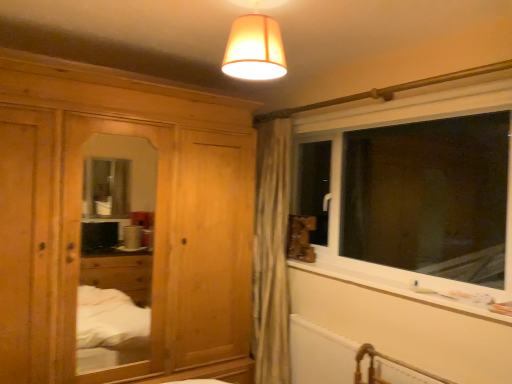
The width and height of the screenshot is (512, 384). What do you see at coordinates (413, 189) in the screenshot? I see `white plastic window at right` at bounding box center [413, 189].

This screenshot has height=384, width=512. What are the coordinates of `white plastic window at right` in the screenshot? It's located at (413, 189).

This screenshot has height=384, width=512. Describe the element at coordinates (321, 354) in the screenshot. I see `white matte radiator at lower right` at that location.

Describe the element at coordinates (403, 284) in the screenshot. I see `white plastic window sill at lower right` at that location.

The width and height of the screenshot is (512, 384). Find the location of `natural wood wardrobe at left`. natural wood wardrobe at left is located at coordinates pyautogui.click(x=155, y=219).

Considering the sizes of matte orange fabric lampshade at upper center and white matte radiator at lower right in the image, is matte orange fabric lampshade at upper center bigger or smaller than white matte radiator at lower right?

In the image, matte orange fabric lampshade at upper center appears to be smaller than white matte radiator at lower right.

From their relative heights in the image, would you say matte orange fabric lampshade at upper center is taller or shorter than white matte radiator at lower right?

Considering their sizes, matte orange fabric lampshade at upper center has less height than white matte radiator at lower right.

Consider the image. Does matte orange fabric lampshade at upper center touch white matte radiator at lower right?

They are not placed beside each other.

From the image's perspective, who appears lower, matte orange fabric lampshade at upper center or white matte radiator at lower right?

white matte radiator at lower right is shown below in the image.

Is natural wood wardrobe at left smaller than matte orange fabric lampshade at upper center?

No, natural wood wardrobe at left is not smaller than matte orange fabric lampshade at upper center.

Looking at this image, would you say natural wood wardrobe at left is to the left or to the right of matte orange fabric lampshade at upper center in the picture?

natural wood wardrobe at left is positioned on matte orange fabric lampshade at upper center's left side.

Is natural wood wardrobe at left outside of matte orange fabric lampshade at upper center?

Absolutely, natural wood wardrobe at left is external to matte orange fabric lampshade at upper center.

Find the location of a particular element. The width and height of the screenshot is (512, 384). lamp in front of the white plastic window at right is located at coordinates (255, 44).

Can you confirm if matte orange fabric lampshade at upper center is positioned to the right of white plastic window at right?

In fact, matte orange fabric lampshade at upper center is to the left of white plastic window at right.

In the scene shown: From the image's perspective, is matte orange fabric lampshade at upper center beneath white plastic window at right?

Actually, matte orange fabric lampshade at upper center appears above white plastic window at right in the image.

Measure the distance between matte orange fabric lampshade at upper center and white plastic window at right.

matte orange fabric lampshade at upper center and white plastic window at right are 5.79 feet apart from each other.

Considering the relative sizes of matte orange fabric lampshade at upper center and white plastic window sill at lower right in the image provided, is matte orange fabric lampshade at upper center wider than white plastic window sill at lower right?

Yes, matte orange fabric lampshade at upper center is wider than white plastic window sill at lower right.

Who is shorter, matte orange fabric lampshade at upper center or white plastic window sill at lower right?

With less height is white plastic window sill at lower right.

How much distance is there between matte orange fabric lampshade at upper center and white plastic window sill at lower right?

They are 4.71 feet apart.

From the image's perspective, who appears lower, matte orange fabric lampshade at upper center or white plastic window sill at lower right?

white plastic window sill at lower right is shown below in the image.

Between white matte radiator at lower right and white plastic window at right, which one is positioned in front?

white matte radiator at lower right is in front.

This screenshot has height=384, width=512. What are the coordinates of `radiator that is on the left side of white plastic window at right` in the screenshot? It's located at (321, 354).

Can you tell me how much white matte radiator at lower right and white plastic window at right differ in facing direction?

They differ by 0.684 degrees in their facing directions.

Which of these two, natural wood wardrobe at left or white plastic window sill at lower right, is thinner?

With smaller width is white plastic window sill at lower right.

From the image's perspective, which object appears higher, natural wood wardrobe at left or white plastic window sill at lower right?

From the image's view, natural wood wardrobe at left is above.

The width and height of the screenshot is (512, 384). In order to click on cabinetry on the left of white plastic window sill at lower right in this screenshot , I will do `click(155, 219)`.

Consider the image. Does natural wood wardrobe at left turn towards white plastic window sill at lower right?

No, natural wood wardrobe at left is not turned towards white plastic window sill at lower right.

From the image's perspective, is white plastic window at right above or below natural wood wardrobe at left?

From the image's perspective, white plastic window at right appears above natural wood wardrobe at left.

From a real-world perspective, is white plastic window at right located higher than natural wood wardrobe at left?

Yes, from a real-world perspective, white plastic window at right is above natural wood wardrobe at left.

Is white plastic window at right positioned with its back to natural wood wardrobe at left?

white plastic window at right is not turned away from natural wood wardrobe at left.

Based on their sizes in the image, would you say white plastic window at right is bigger or smaller than natural wood wardrobe at left?

Clearly, white plastic window at right is smaller in size than natural wood wardrobe at left.

Locate an element on the screen. Image resolution: width=512 pixels, height=384 pixels. radiator located behind the matte orange fabric lampshade at upper center is located at coordinates (321, 354).

Identify the location of lamp that appears on the right of natural wood wardrobe at left. This screenshot has width=512, height=384. (255, 44).

Based on their spatial positions, is matte orange fabric lampshade at upper center or white plastic window sill at lower right closer to white plastic window at right?

The object closer to white plastic window at right is white plastic window sill at lower right.

Looking at the image, which one is located closer to white plastic window at right, white plastic window sill at lower right or natural wood wardrobe at left?

white plastic window sill at lower right is positioned closer to the anchor white plastic window at right.

Based on the photo, based on their spatial positions, is matte orange fabric lampshade at upper center or white matte radiator at lower right closer to white plastic window at right?

Among the two, white matte radiator at lower right is located nearer to white plastic window at right.

Looking at the image, which one is located further to matte orange fabric lampshade at upper center, natural wood wardrobe at left or white plastic window at right?

The object further to matte orange fabric lampshade at upper center is white plastic window at right.

Estimate the real-world distances between objects in this image. Which object is closer to matte orange fabric lampshade at upper center, white matte radiator at lower right or natural wood wardrobe at left?

Based on the image, natural wood wardrobe at left appears to be nearer to matte orange fabric lampshade at upper center.

When comparing their distances from white plastic window sill at lower right, does natural wood wardrobe at left or white plastic window at right seem closer?

The object closer to white plastic window sill at lower right is white plastic window at right.

Based on their spatial positions, is matte orange fabric lampshade at upper center or natural wood wardrobe at left further from white plastic window at right?

matte orange fabric lampshade at upper center is positioned further to the anchor white plastic window at right.

When comparing their distances from matte orange fabric lampshade at upper center, does white plastic window sill at lower right or white matte radiator at lower right seem further?

white matte radiator at lower right is positioned further to the anchor matte orange fabric lampshade at upper center.

Where is `window sill between matte orange fabric lampshade at upper center and white matte radiator at lower right vertically`? window sill between matte orange fabric lampshade at upper center and white matte radiator at lower right vertically is located at coordinates (403, 284).

At what (x,y) coordinates should I click in order to perform the action: click on window sill between white plastic window at right and white matte radiator at lower right in the vertical direction. Please return your answer as a coordinate pair (x, y). This screenshot has height=384, width=512. Looking at the image, I should click on [x=403, y=284].

Locate an element on the screen. window between matte orange fabric lampshade at upper center and white matte radiator at lower right from top to bottom is located at coordinates (413, 189).

The image size is (512, 384). I want to click on radiator between natural wood wardrobe at left and white plastic window at right, so click(x=321, y=354).